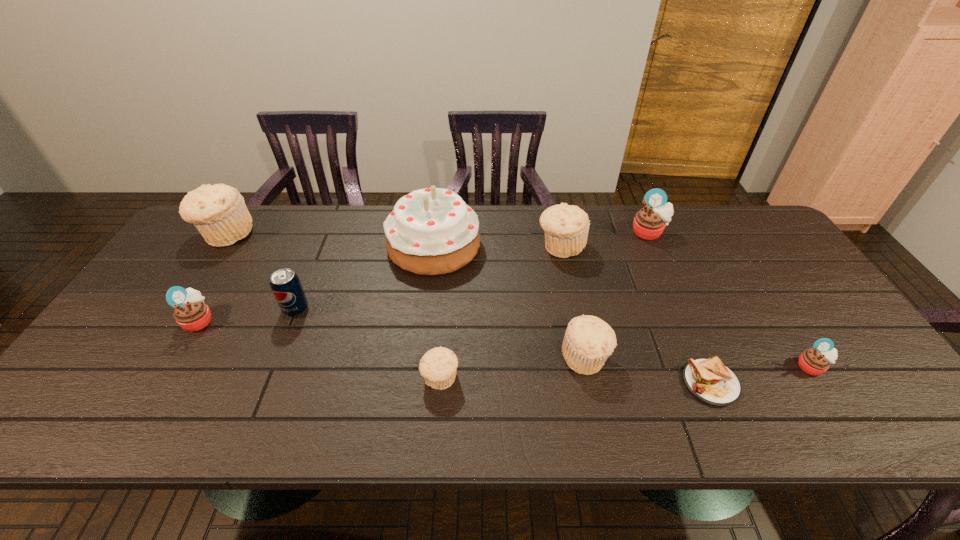
You are a GUI agent. You are given a task and a screenshot of the screen. Output one action in this format:
    pyautogui.click(x=<x>, y=<y>)
    Task: Click on the red cake
    The image size is (960, 540).
    Given the screenshot: What is the action you would take?
    pyautogui.click(x=432, y=231)

Where is `the biggest beige muffin`? The image size is (960, 540). the biggest beige muffin is located at coordinates (219, 212).

Find the location of `the second pink muffin from right to left`. the second pink muffin from right to left is located at coordinates (649, 223).

Identify the location of the second muffin from right to left. (649, 223).

Locate an element on the screen. This screenshot has height=540, width=960. the second biggest beige muffin is located at coordinates (566, 227).

The height and width of the screenshot is (540, 960). I want to click on the eighth object from right to left, so click(285, 284).

Locate an element on the screen. The image size is (960, 540). the leftmost pink muffin is located at coordinates (191, 313).

The image size is (960, 540). Find the location of `the fourth farthest muffin`. the fourth farthest muffin is located at coordinates coord(191,313).

This screenshot has width=960, height=540. In order to click on the second smallest beige muffin in this screenshot , I will do `click(588, 342)`.

Locate an element on the screen. The width and height of the screenshot is (960, 540). the nearest pink muffin is located at coordinates (815, 361).